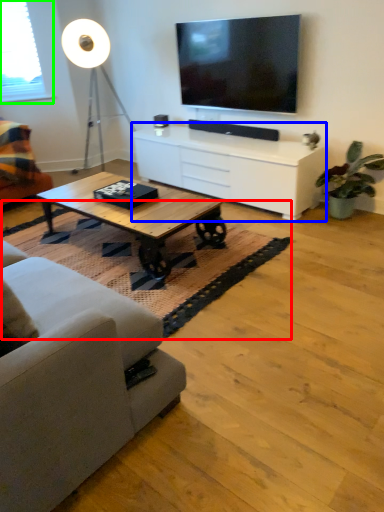
Question: Based on their relative distances, which object is nearer to mat (highlighted by a red box)? Choose from cabinetry (highlighted by a blue box) and window screen (highlighted by a green box).

Choices:
 (A) cabinetry
 (B) window screen

Answer: (A)